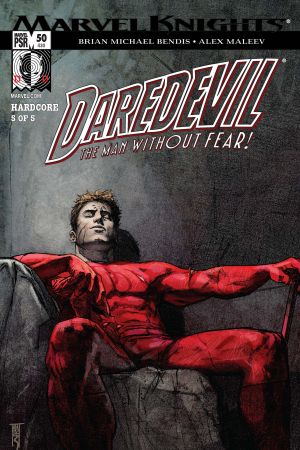
You are a GUI agent. You are given a task and a screenshot of the screen. Output one action in this format:
    pyautogui.click(x=<x>, y=<y>)
    Task: Click on the cover
    Image resolution: width=300 pixels, height=450 pixels.
    Given the screenshot: What is the action you would take?
    pyautogui.click(x=243, y=318)